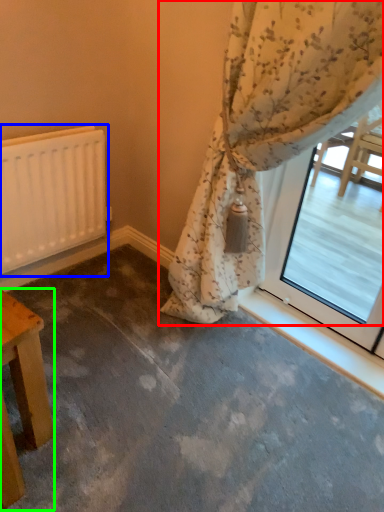
Question: Which object is the closest to the curtain (highlighted by a red box)? Choose among these: radiator (highlighted by a blue box) or table (highlighted by a green box).

Choices:
 (A) radiator
 (B) table

Answer: (A)